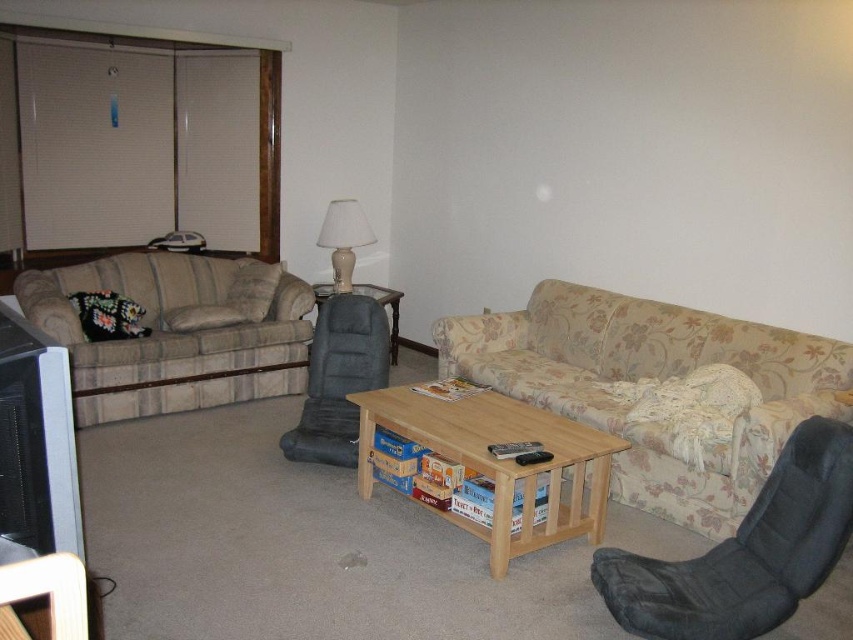
You are planning to place a rectangular decorative item that is 15 cm wide on the white fabric lampshade at center and the matte gray side table at center. Which surface can accommodate the item based on their widths?

The white fabric lampshade at center has a width less than the matte gray side table at center. Since the decorative item is 15 cm wide, it can fit on the matte gray side table at center but not on the white fabric lampshade at center.

You are a guest in the living room and want to turn on the light. You see the white fabric lampshade at center and the matte gray side table at center. Which object should you interact with to activate the light?

The white fabric lampshade at center is above the matte gray side table at center, so you should interact with the white fabric lampshade at center to activate the light.

From the picture: You are standing in the living room and want to sit down. The floral fabric couch at center is your target. Based on its 2D coordinates, in which general area of the room should you look to find it?

The floral fabric couch at center is located at the coordinates point (653,378), so you should look towards the center area of the room.